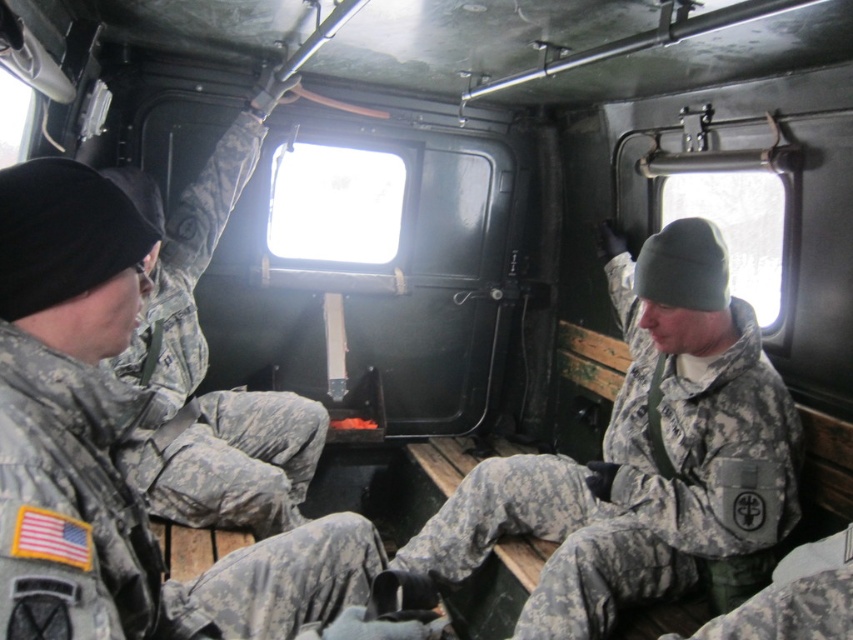
Question: Which point is farther from the camera taking this photo?

Choices:
 (A) (231, 522)
 (B) (105, 465)

Answer: (A)

Question: Which point appears farthest from the camera in this image?

Choices:
 (A) (123, 273)
 (B) (648, 417)
 (C) (206, 369)

Answer: (C)

Question: Where is camouflage fabric uniform at center located in relation to camouflage fabric uniform at left in the image?

Choices:
 (A) right
 (B) left

Answer: (A)

Question: Is camouflage fabric uniform at center wider than camouflage uniform at left?

Choices:
 (A) yes
 (B) no

Answer: (A)

Question: Considering the relative positions of camouflage uniform at left and camouflage fabric uniform at left in the image provided, where is camouflage uniform at left located with respect to camouflage fabric uniform at left?

Choices:
 (A) left
 (B) right

Answer: (B)

Question: Among these objects, which one is nearest to the camera?

Choices:
 (A) camouflage fabric uniform at center
 (B) camouflage uniform at left
 (C) camouflage fabric uniform at left

Answer: (B)